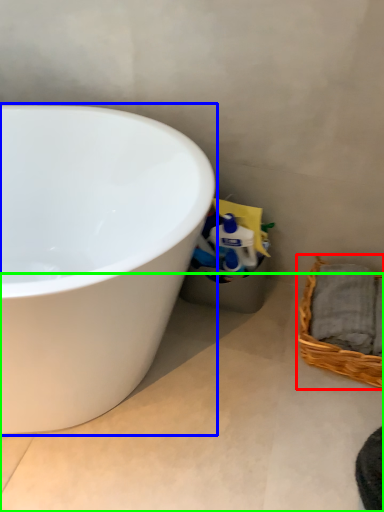
Question: Which is farther away from picnic basket (highlighted by a red box)? bathtub (highlighted by a blue box) or concrete (highlighted by a green box)?

Choices:
 (A) bathtub
 (B) concrete

Answer: (A)